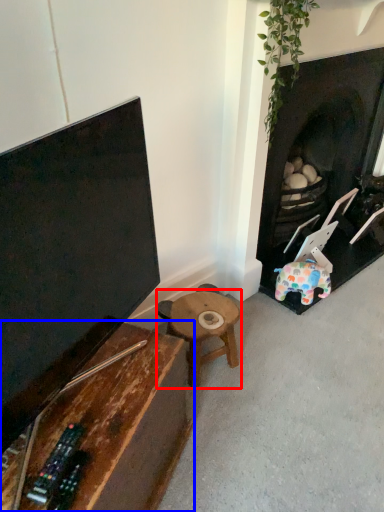
Question: Which object is further to the camera taking this photo, table (highlighted by a red box) or table (highlighted by a blue box)?

Choices:
 (A) table
 (B) table

Answer: (A)